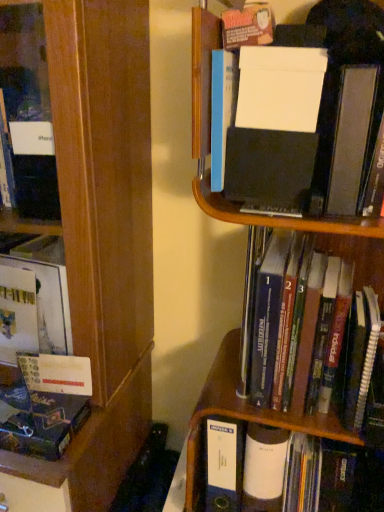
Question: Does white matte folder at upper right, arranged as the third book when ordered from the bottom, come in front of hardcover book at center, which ranks as the 2th book in top-to-bottom order?

Choices:
 (A) no
 (B) yes

Answer: (B)

Question: Does white matte folder at upper right, marked as the 2th book in a right-to-left arrangement, have a larger size compared to hardcover book at center, which ranks as the 2th book in top-to-bottom order?

Choices:
 (A) yes
 (B) no

Answer: (B)

Question: Would you consider white matte folder at upper right, the 1th book in the top-to-bottom sequence, to be distant from hardcover book at center, which ranks as the 2th book in top-to-bottom order?

Choices:
 (A) yes
 (B) no

Answer: (B)

Question: Does white matte folder at upper right, arranged as the third book when ordered from the bottom, contain hardcover book at center, which ranks as the 2th book in top-to-bottom order?

Choices:
 (A) yes
 (B) no

Answer: (B)

Question: Considering the relative sizes of white matte folder at upper right, the 1th book in the top-to-bottom sequence, and hardcover book at center, the 1th book positioned from the right, in the image provided, is white matte folder at upper right, the 1th book in the top-to-bottom sequence, shorter than hardcover book at center, the 1th book positioned from the right,?

Choices:
 (A) yes
 (B) no

Answer: (A)

Question: Looking at the image, does white matte folder at upper right, the 1th book in the top-to-bottom sequence, seem bigger or smaller compared to matte black book at lower left, the first book in the left-to-right sequence?

Choices:
 (A) big
 (B) small

Answer: (A)

Question: Does point (256, 208) appear closer or farther from the camera than point (41, 423)?

Choices:
 (A) closer
 (B) farther

Answer: (A)

Question: In the image, is white matte folder at upper right, arranged as the third book when ordered from the bottom, on the left side or the right side of matte black book at lower left, which is the 1th book in bottom-to-top order?

Choices:
 (A) right
 (B) left

Answer: (A)

Question: Do you think white matte folder at upper right, marked as the 2th book in a right-to-left arrangement, is within matte black book at lower left, which appears as the third book when viewed from the right, or outside of it?

Choices:
 (A) outside
 (B) inside

Answer: (A)

Question: From the image's perspective, is wooden bookcase at left located above or below hardcover book at center, the 3th book from the left?

Choices:
 (A) above
 (B) below

Answer: (B)

Question: Looking at the image, does wooden bookcase at left seem bigger or smaller compared to hardcover book at center, which ranks as the 2th book in top-to-bottom order?

Choices:
 (A) big
 (B) small

Answer: (A)

Question: Do you think wooden bookcase at left is within hardcover book at center, the 3th book from the left, or outside of it?

Choices:
 (A) inside
 (B) outside

Answer: (B)

Question: Considering the positions of wooden bookcase at left and hardcover book at center, the 1th book positioned from the right, in the image, is wooden bookcase at left taller or shorter than hardcover book at center, the 1th book positioned from the right,?

Choices:
 (A) short
 (B) tall

Answer: (B)

Question: Which is correct: matte black book at lower left, which is the 1th book in bottom-to-top order, is inside hardcover book at center, the 3th book from the left, or outside of it?

Choices:
 (A) inside
 (B) outside

Answer: (B)

Question: In the image, is matte black book at lower left, the first book in the left-to-right sequence, positioned in front of or behind hardcover book at center, the 1th book positioned from the right?

Choices:
 (A) front
 (B) behind

Answer: (B)